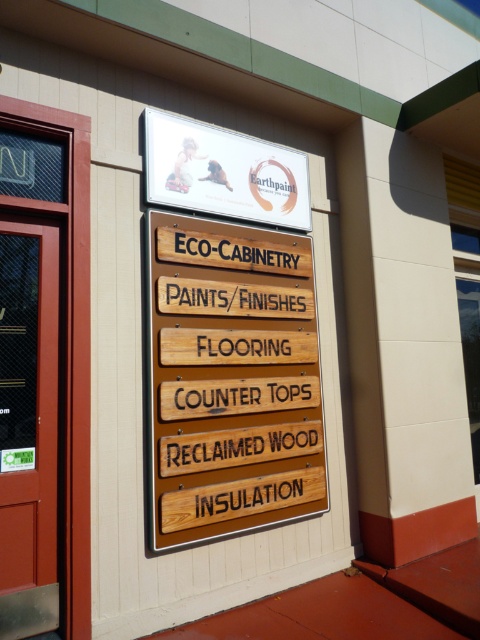
You are an architect visiting a construction site and need to determine the relative sizes of the wooden sign at center and the white matte sign at upper center. Based on the scene, which sign is taller?

The wooden sign at center is taller than the white matte sign at upper center according to the description.

You are a delivery person carrying a box that is 90 centimeters wide. You need to maneuver it through the space between the wooden sign at center and the matte glass door at left. Can you fit the box through that space?

The distance between the wooden sign at center and the matte glass door at left is 84.71 centimeters. Since the box is 90 centimeters wide, it is wider than the available space, so the box cannot fit through that space.